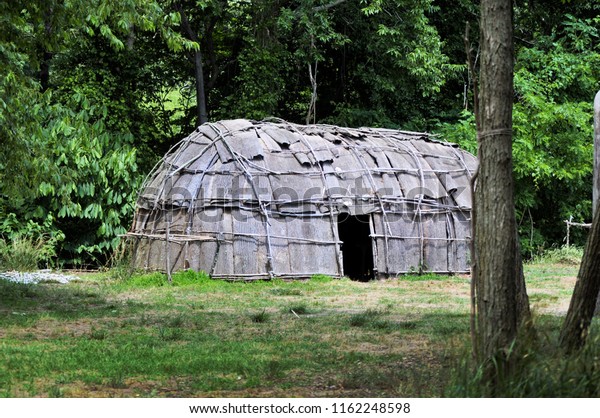
What are the coordinates of `door opening` in the screenshot? It's located at (349, 260).